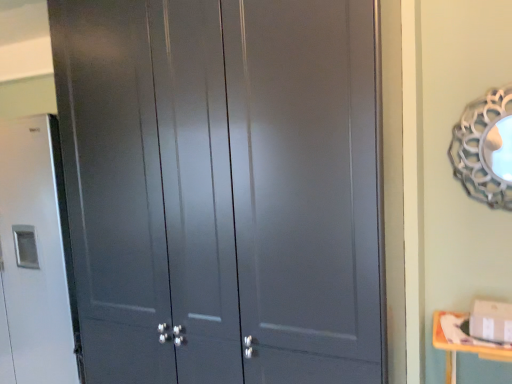
Question: Would you say yellow wood changing table at lower right is outside matte gray cabinet at center?

Choices:
 (A) yes
 (B) no

Answer: (A)

Question: Is yellow wood changing table at lower right to the left of matte gray cabinet at center from the viewer's perspective?

Choices:
 (A) yes
 (B) no

Answer: (B)

Question: Considering the relative sizes of yellow wood changing table at lower right and matte gray cabinet at center in the image provided, is yellow wood changing table at lower right bigger than matte gray cabinet at center?

Choices:
 (A) yes
 (B) no

Answer: (B)

Question: Are yellow wood changing table at lower right and matte gray cabinet at center located far from each other?

Choices:
 (A) yes
 (B) no

Answer: (A)

Question: Can you confirm if yellow wood changing table at lower right is wider than matte gray cabinet at center?

Choices:
 (A) yes
 (B) no

Answer: (B)

Question: From the image's perspective, is matte gray cabinet at center located above or below metallic silver mirror at upper right?

Choices:
 (A) below
 (B) above

Answer: (A)

Question: Is matte gray cabinet at center wider or thinner than metallic silver mirror at upper right?

Choices:
 (A) wide
 (B) thin

Answer: (A)

Question: Does point (360, 168) appear closer or farther from the camera than point (486, 167)?

Choices:
 (A) closer
 (B) farther

Answer: (A)

Question: Based on their sizes in the image, would you say matte gray cabinet at center is bigger or smaller than metallic silver mirror at upper right?

Choices:
 (A) small
 (B) big

Answer: (B)

Question: From the image's perspective, is metallic silver mirror at upper right above or below yellow wood changing table at lower right?

Choices:
 (A) below
 (B) above

Answer: (B)

Question: Is metallic silver mirror at upper right situated inside yellow wood changing table at lower right or outside?

Choices:
 (A) outside
 (B) inside

Answer: (A)

Question: Considering the positions of point (504, 120) and point (475, 347), is point (504, 120) closer or farther from the camera than point (475, 347)?

Choices:
 (A) closer
 (B) farther

Answer: (B)

Question: Looking at their shapes, would you say metallic silver mirror at upper right is wider or thinner than yellow wood changing table at lower right?

Choices:
 (A) wide
 (B) thin

Answer: (B)

Question: In terms of width, does matte gray cabinet at left look wider or thinner when compared to yellow wood changing table at lower right?

Choices:
 (A) thin
 (B) wide

Answer: (B)

Question: Does point (75, 170) appear closer or farther from the camera than point (454, 347)?

Choices:
 (A) closer
 (B) farther

Answer: (A)